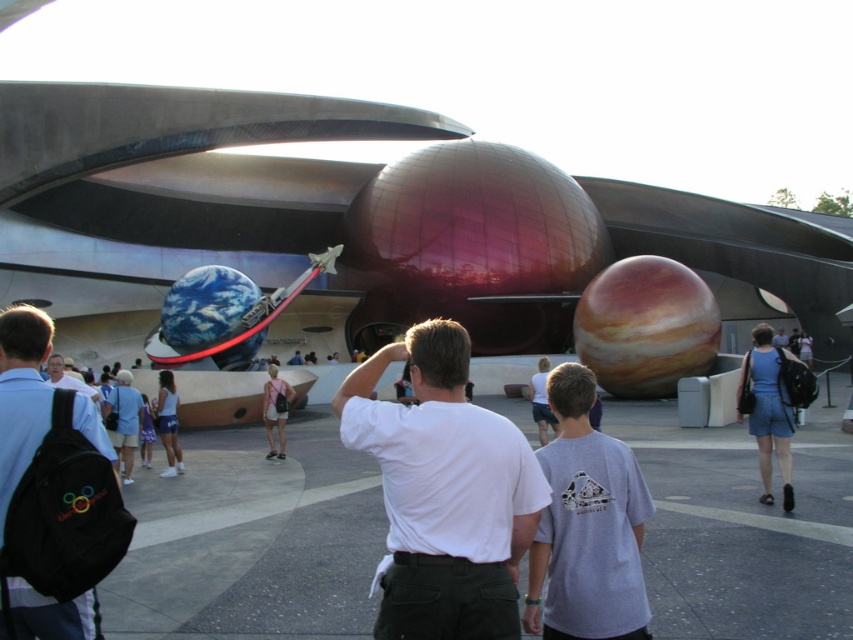
Between black fabric backpack at left and light blue shirt at center, which one appears on the right side from the viewer's perspective?

black fabric backpack at left

Is point (16, 442) behind point (56, 362)?

No, it is not.

I want to click on black fabric backpack at left, so click(x=22, y=369).

From the picture: Does white cotton shirt at center have a larger size compared to light blue shirt at center?

No, white cotton shirt at center is not bigger than light blue shirt at center.

Where is `white cotton shirt at center`? white cotton shirt at center is located at coordinates (444, 492).

Image resolution: width=853 pixels, height=640 pixels. In order to click on white cotton shirt at center in this screenshot , I will do `click(444, 492)`.

Can you confirm if white cotton shirt at center is positioned below black fabric backpack at left?

Correct, white cotton shirt at center is located below black fabric backpack at left.

Which is above, white cotton shirt at center or black fabric backpack at left?

black fabric backpack at left is above.

Is point (401, 611) positioned before point (71, 403)?

Yes, point (401, 611) is closer to viewer.

At what (x,y) coordinates should I click in order to perform the action: click on white cotton shirt at center. Please return your answer as a coordinate pair (x, y). Looking at the image, I should click on (444, 492).